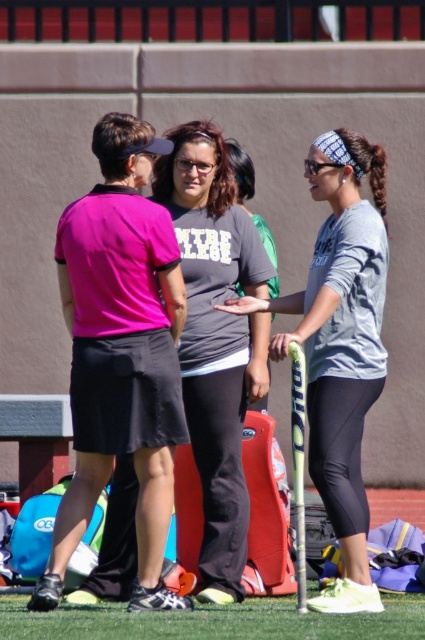
Question: Is gray matte tennis racket at center to the left of green artificial turf at lower center from the viewer's perspective?

Choices:
 (A) yes
 (B) no

Answer: (B)

Question: In this image, where is gray matte tennis racket at center located relative to matte gray t-shirt at center?

Choices:
 (A) below
 (B) above

Answer: (A)

Question: Which point is closer to the camera taking this photo?

Choices:
 (A) (260, 342)
 (B) (312, 385)

Answer: (B)

Question: Which object is positioned farthest from the gray matte tennis racket at center?

Choices:
 (A) green artificial turf at lower center
 (B) matte gray t-shirt at center

Answer: (A)

Question: Which of the following is the farthest from the observer?

Choices:
 (A) green artificial turf at lower center
 (B) gray matte tennis racket at center
 (C) matte gray t-shirt at center

Answer: (C)

Question: In this image, where is gray matte tennis racket at center located relative to green artificial turf at lower center?

Choices:
 (A) right
 (B) left

Answer: (A)